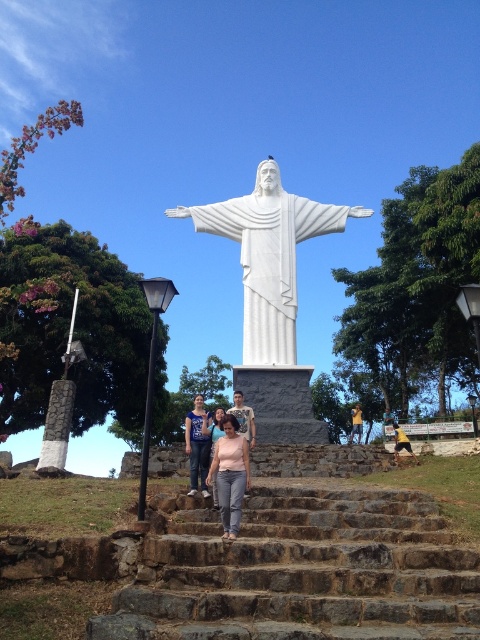
Does brown stone stairs at center have a smaller size compared to white marble statue at center?

Indeed, brown stone stairs at center has a smaller size compared to white marble statue at center.

Is brown stone stairs at center to the left of white marble statue at center from the viewer's perspective?

Incorrect, brown stone stairs at center is not on the left side of white marble statue at center.

Where is `brown stone stairs at center`? This screenshot has height=640, width=480. brown stone stairs at center is located at coordinates (302, 572).

The image size is (480, 640). I want to click on brown stone stairs at center, so click(302, 572).

Between white marble statue at center and matte pink shirt at center, which one appears on the left side from the viewer's perspective?

Positioned to the left is matte pink shirt at center.

Measure the distance from white marble statue at center to matte pink shirt at center.

white marble statue at center is 101.60 feet from matte pink shirt at center.

Who is more forward, (264,243) or (216,429)?

Point (216,429)

The height and width of the screenshot is (640, 480). Find the location of `white marble statue at center`. white marble statue at center is located at coordinates (268, 256).

Which is above, brown stone stairs at center or matte pink shirt at center?

brown stone stairs at center

Measure the distance between brown stone stairs at center and matte pink shirt at center.

brown stone stairs at center and matte pink shirt at center are 27.12 feet apart.

This screenshot has width=480, height=640. Describe the element at coordinates (302, 572) in the screenshot. I see `brown stone stairs at center` at that location.

Identify the location of brown stone stairs at center. This screenshot has height=640, width=480. (302, 572).